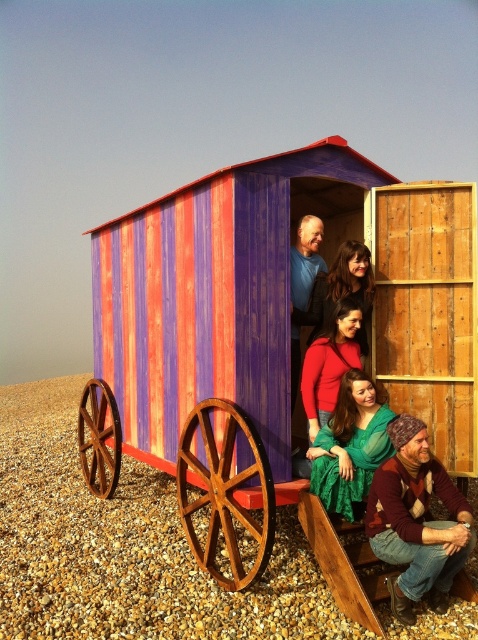
Question: Is green sheer dress at center behind matte red sweater at center?

Choices:
 (A) yes
 (B) no

Answer: (B)

Question: Which object is closer to the camera taking this photo?

Choices:
 (A) matte red sweater at center
 (B) green sheer dress at center

Answer: (B)

Question: Does knitted woolen hat at lower right have a greater width compared to green sheer dress at center?

Choices:
 (A) no
 (B) yes

Answer: (B)

Question: Is green sheer dress at center closer to the viewer compared to matte red sweater at center?

Choices:
 (A) yes
 (B) no

Answer: (A)

Question: Among these objects, which one is nearest to the camera?

Choices:
 (A) wooden cabin at center
 (B) green sheer dress at center

Answer: (B)

Question: Which point appears closest to the camera in this image?

Choices:
 (A) (381, 445)
 (B) (344, 353)

Answer: (A)